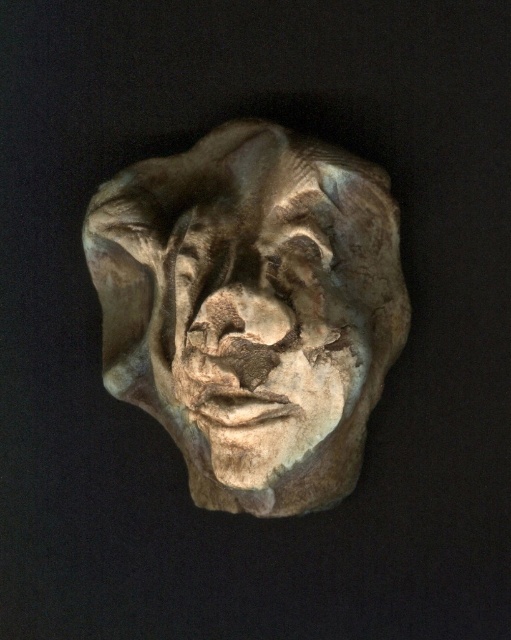
Describe the element at coordinates (251, 308) in the screenshot. This screenshot has height=640, width=511. I see `matte stone face at center` at that location.

Does matte stone face at center appear on the left side of rustic stone face at center?

Correct, you'll find matte stone face at center to the left of rustic stone face at center.

The image size is (511, 640). Describe the element at coordinates (251, 308) in the screenshot. I see `matte stone face at center` at that location.

At what (x,y) coordinates should I click in order to perform the action: click on matte stone face at center. Please return your answer as a coordinate pair (x, y). The height and width of the screenshot is (640, 511). Looking at the image, I should click on (251, 308).